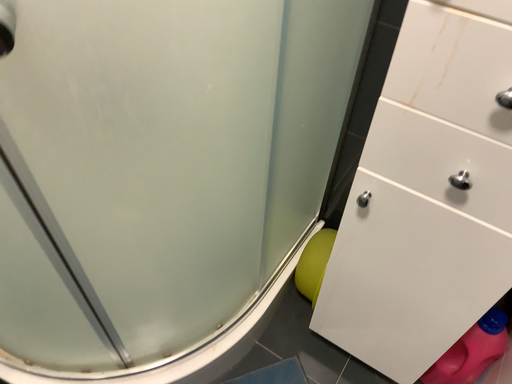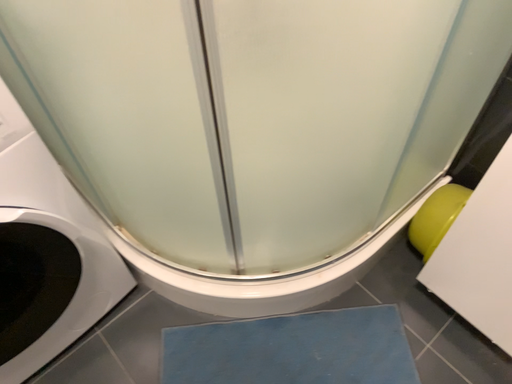
Question: How did the camera likely rotate when shooting the video?

Choices:
 (A) rotated right
 (B) rotated left

Answer: (B)